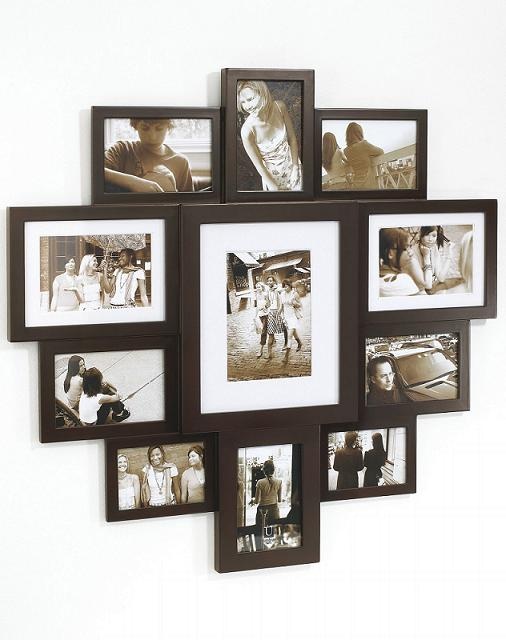
This screenshot has height=640, width=506. What are the coordinates of `framed pictures` in the screenshot? It's located at (151, 132), (264, 132), (350, 137), (87, 262), (251, 266), (402, 262), (89, 388), (164, 475), (364, 456), (425, 372).